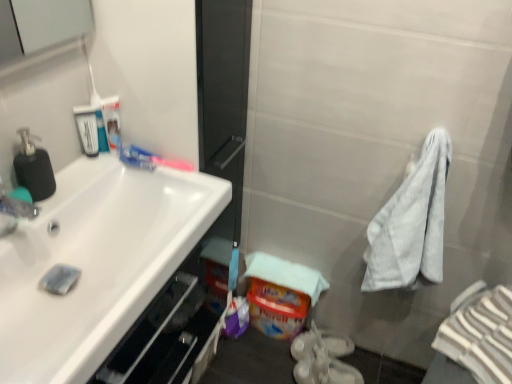
Question: From a real-world perspective, is matte black soap dispenser at left located higher than white striped bath towel at right?

Choices:
 (A) yes
 (B) no

Answer: (A)

Question: Is white striped bath towel at right surrounded by matte black soap dispenser at left?

Choices:
 (A) no
 (B) yes

Answer: (A)

Question: Is matte black soap dispenser at left not within white striped bath towel at right?

Choices:
 (A) yes
 (B) no

Answer: (A)

Question: Are matte black soap dispenser at left and white striped bath towel at right located far from each other?

Choices:
 (A) yes
 (B) no

Answer: (A)

Question: Does matte black soap dispenser at left have a lesser width compared to white striped bath towel at right?

Choices:
 (A) yes
 (B) no

Answer: (A)

Question: From a real-world perspective, is matte black soap dispenser at left above or below white glossy toothpaste at upper left?

Choices:
 (A) above
 (B) below

Answer: (A)

Question: In the image, is matte black soap dispenser at left on the left side or the right side of white glossy toothpaste at upper left?

Choices:
 (A) right
 (B) left

Answer: (B)

Question: Relative to white glossy toothpaste at upper left, is matte black soap dispenser at left in front or behind?

Choices:
 (A) behind
 (B) front

Answer: (B)

Question: Is matte black soap dispenser at left inside or outside of white glossy toothpaste at upper left?

Choices:
 (A) outside
 (B) inside

Answer: (A)

Question: Would you say white glossy sink at left is to the left or to the right of white plastic mouthwash at upper left, acting as the 1th mouthwash starting from the left, in the picture?

Choices:
 (A) left
 (B) right

Answer: (B)

Question: From the image's perspective, is white glossy sink at left located above or below white plastic mouthwash at upper left, marked as the 2th mouthwash in a right-to-left arrangement?

Choices:
 (A) below
 (B) above

Answer: (A)

Question: In terms of size, does white glossy sink at left appear bigger or smaller than white plastic mouthwash at upper left, acting as the 1th mouthwash starting from the left?

Choices:
 (A) small
 (B) big

Answer: (B)

Question: Is white glossy sink at left in front of or behind white plastic mouthwash at upper left, acting as the 1th mouthwash starting from the left, in the image?

Choices:
 (A) front
 (B) behind

Answer: (A)

Question: In terms of height, does white plastic mouthwash at upper left, acting as the 1th mouthwash starting from the left, look taller or shorter compared to clear plastic bottle at upper left, marked as the second mouthwash in a left-to-right arrangement?

Choices:
 (A) short
 (B) tall

Answer: (A)

Question: Considering the positions of point coord(78,109) and point coord(112,109), is point coord(78,109) closer or farther from the camera than point coord(112,109)?

Choices:
 (A) farther
 (B) closer

Answer: (B)